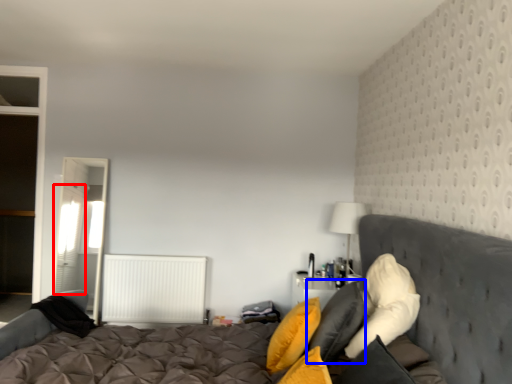
Question: Which object is closer to the camera taking this photo, curtain (highlighted by a red box) or pillow (highlighted by a blue box)?

Choices:
 (A) curtain
 (B) pillow

Answer: (B)